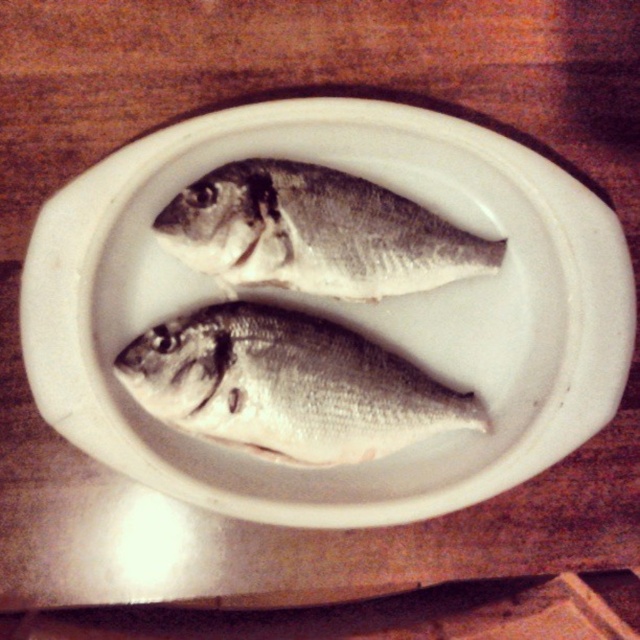
Which is more to the right, white ceramic plate at center or silver/glossy fish at center?

silver/glossy fish at center

Which is above, white ceramic plate at center or silver/glossy fish at center?

silver/glossy fish at center is higher up.

The height and width of the screenshot is (640, 640). What are the coordinates of `white ceramic plate at center` in the screenshot? It's located at (340, 308).

Between white ceramic plate at center and shiny silver fish at center, which one appears on the left side from the viewer's perspective?

Positioned to the left is shiny silver fish at center.

Between point (49, 307) and point (152, 392), which one is positioned in front?

Point (49, 307) is in front.

The width and height of the screenshot is (640, 640). What do you see at coordinates (340, 308) in the screenshot?
I see `white ceramic plate at center` at bounding box center [340, 308].

The height and width of the screenshot is (640, 640). What are the coordinates of `white ceramic plate at center` in the screenshot? It's located at (340, 308).

In the scene shown: Who is shorter, shiny silver fish at center or silver/glossy fish at center?

silver/glossy fish at center is shorter.

Can you confirm if shiny silver fish at center is shorter than silver/glossy fish at center?

No.

Who is more forward, (x=342, y=342) or (x=317, y=292)?

Positioned in front is point (x=342, y=342).

Where is `shiny silver fish at center`? shiny silver fish at center is located at coordinates (288, 385).